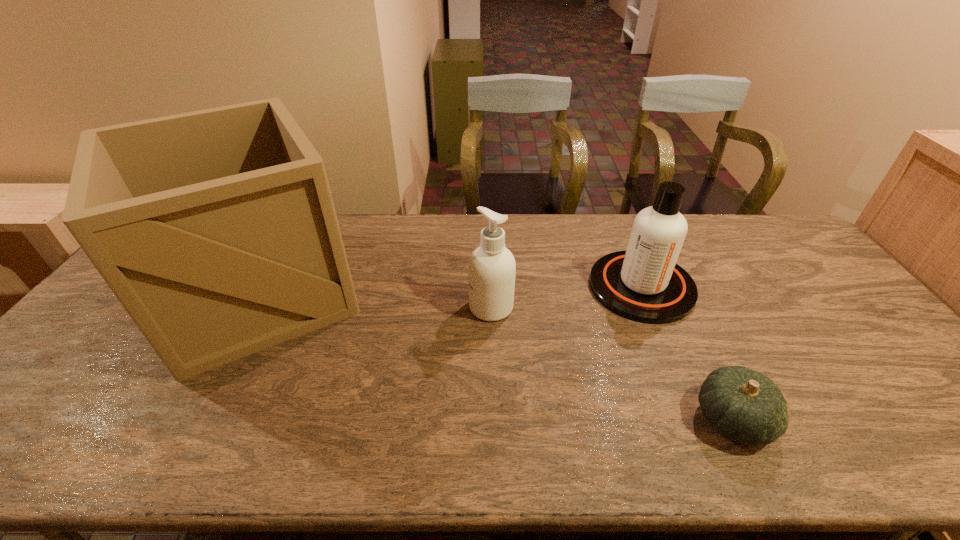
Find the location of a particular element. Image resolution: width=960 pixels, height=540 pixels. blank space located on the front label of the third object from right to left is located at coordinates (403, 307).

Where is `free space located on the back of the shortest object`? free space located on the back of the shortest object is located at coordinates (697, 345).

Locate an element on the screen. The image size is (960, 540). object positioned at the far edge is located at coordinates (216, 230).

Identify the location of object that is positioned at the near edge. The width and height of the screenshot is (960, 540). (743, 405).

Image resolution: width=960 pixels, height=540 pixels. Find the location of `object that is at the left edge`. object that is at the left edge is located at coordinates (216, 230).

Image resolution: width=960 pixels, height=540 pixels. In order to click on object present at the far left corner in this screenshot , I will do `click(216, 230)`.

At what (x,y) coordinates should I click in order to perform the action: click on free space at the far edge of the desktop. Please return your answer as a coordinate pair (x, y). The width and height of the screenshot is (960, 540). Looking at the image, I should click on pos(559,246).

At what (x,y) coordinates should I click in order to perform the action: click on free region at the near edge. Please return your answer as a coordinate pair (x, y). Image resolution: width=960 pixels, height=540 pixels. Looking at the image, I should click on (809, 447).

The image size is (960, 540). What are the coordinates of `vacant space at the left edge of the desktop` in the screenshot? It's located at (42, 376).

In the image, there is a desktop. Where is `vacant space at the right edge`? The height and width of the screenshot is (540, 960). vacant space at the right edge is located at coordinates (921, 388).